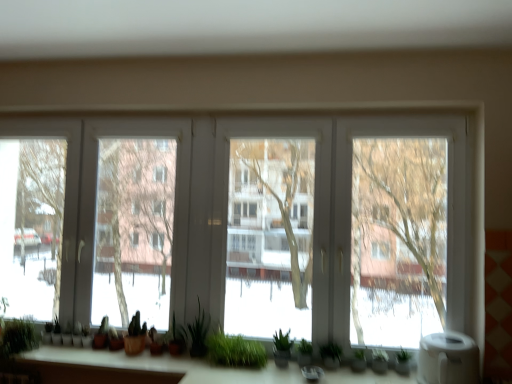
How much space does green matte plant at lower center, which appears as the sixth plant when viewed from the left, occupy horizontally?

5.14 inches.

The image size is (512, 384). Identify the location of green matte plant at lower left, the fifth plant viewed from the right. (102, 334).

Where is `green matte plant at center, the fourth plant in the right-to-left sequence`? The width and height of the screenshot is (512, 384). green matte plant at center, the fourth plant in the right-to-left sequence is located at coordinates (175, 339).

You are a GUI agent. You are given a task and a screenshot of the screen. Output one action in this format:
    pyautogui.click(x=<x>, y=<y>)
    Task: Click on the green matte plant at lower center, which is the second plant in right-to-left order
    The width and height of the screenshot is (512, 384).
    Given the screenshot: What is the action you would take?
    pyautogui.click(x=331, y=351)

I want to click on green grass at center, so click(x=234, y=351).

Does transparent glass windows at center have a lesser height compared to green matte plant at center, which appears as the third plant when viewed from the left?

No.

From a real-world perspective, who is located higher, transparent glass windows at center or green matte plant at center, the fourth plant in the right-to-left sequence?

transparent glass windows at center.

Where is `window to the right of green matte plant at center, which appears as the third plant when viewed from the left`? window to the right of green matte plant at center, which appears as the third plant when viewed from the left is located at coordinates (228, 200).

Consider the image. Is transparent glass windows at center at the left side of green matte plant at center, which appears as the third plant when viewed from the left?

In fact, transparent glass windows at center is to the right of green matte plant at center, which appears as the third plant when viewed from the left.

Which is more to the left, green matte plant at center, the fourth plant in the right-to-left sequence, or transparent glass windows at center?

green matte plant at center, the fourth plant in the right-to-left sequence.

How many degrees apart are the facing directions of green matte plant at center, the fourth plant in the right-to-left sequence, and transparent glass windows at center?

The angle between the facing direction of green matte plant at center, the fourth plant in the right-to-left sequence, and the facing direction of transparent glass windows at center is 4.19e-05 degrees.

Between green matte plant at center, the fourth plant in the right-to-left sequence, and transparent glass windows at center, which one has smaller size?

With smaller size is green matte plant at center, the fourth plant in the right-to-left sequence.

Is white matte water heater at lower right to the left of transparent glass windows at center from the viewer's perspective?

No, white matte water heater at lower right is not to the left of transparent glass windows at center.

Based on their sizes in the image, would you say white matte water heater at lower right is bigger or smaller than transparent glass windows at center?

Clearly, white matte water heater at lower right is smaller in size than transparent glass windows at center.

Would you consider green grass at center to be distant from transparent glass windows at center?

They are positioned close to each other.

Can you confirm if green grass at center is shorter than transparent glass windows at center?

Correct, green grass at center is not as tall as transparent glass windows at center.

Is green grass at center spatially inside transparent glass windows at center, or outside of it?

green grass at center cannot be found inside transparent glass windows at center.

Between green grass at center and transparent glass windows at center, which one appears on the left side from the viewer's perspective?

transparent glass windows at center.

Is white matte water heater at lower right behind green matte plant at lower left, acting as the second plant starting from the left?

That is False.

From a real-world perspective, is white matte water heater at lower right physically below green matte plant at lower left, the fifth plant viewed from the right?

No.

Between white matte water heater at lower right and green matte plant at lower left, the fifth plant viewed from the right, which one appears on the right side from the viewer's perspective?

From the viewer's perspective, white matte water heater at lower right appears more on the right side.

Is white matte water heater at lower right located outside green matte plant at lower left, acting as the second plant starting from the left?

Indeed, white matte water heater at lower right is completely outside green matte plant at lower left, acting as the second plant starting from the left.

From the image's perspective, is green matte plant at lower center, the 5th plant positioned from the left, above or below green matte plant at lower center, which appears as the sixth plant when viewed from the left?

From the image's perspective, green matte plant at lower center, the 5th plant positioned from the left, appears above green matte plant at lower center, which appears as the sixth plant when viewed from the left.

From a real-world perspective, is green matte plant at lower center, which is the second plant in right-to-left order, on green matte plant at lower center, which appears as the sixth plant when viewed from the left?

Yes.

Does green matte plant at lower center, the 5th plant positioned from the left, appear on the left side of green matte plant at lower center, which ranks as the 1th plant in right-to-left order?

Indeed, green matte plant at lower center, the 5th plant positioned from the left, is positioned on the left side of green matte plant at lower center, which ranks as the 1th plant in right-to-left order.

From their relative heights in the image, would you say green matte plant at lower center, the 5th plant positioned from the left, is taller or shorter than green matte plant at lower center, which ranks as the 1th plant in right-to-left order?

Considering their sizes, green matte plant at lower center, the 5th plant positioned from the left, has less height than green matte plant at lower center, which ranks as the 1th plant in right-to-left order.

From a real-world perspective, relative to transparent glass windows at center, is green matte plant at lower center, the 5th plant positioned from the left, vertically above or below?

green matte plant at lower center, the 5th plant positioned from the left, is below transparent glass windows at center.

Find the location of a particular element. window above the green matte plant at lower center, which is the second plant in right-to-left order (from the image's perspective) is located at coordinates (228, 200).

Between point (334, 353) and point (338, 213), which one is positioned in front?

Positioned in front is point (334, 353).

Does green matte plant at lower center, the 5th plant positioned from the left, have a lesser width compared to transparent glass windows at center?

Incorrect, the width of green matte plant at lower center, the 5th plant positioned from the left, is not less than that of transparent glass windows at center.

There is a transparent glass windows at center. Find the location of `the 2nd plant below it (from a real-world perspective)`. the 2nd plant below it (from a real-world perspective) is located at coordinates (175, 339).

I want to click on window above the green matte plant at center, the fourth plant in the right-to-left sequence (from the image's perspective), so click(228, 200).

Estimate the real-world distances between objects in this image. Which object is closer to green grass at center, green matte plant at lower center, which appears as the sixth plant when viewed from the left, or green matte plant at lower left, the fifth plant viewed from the right?

green matte plant at lower center, which appears as the sixth plant when viewed from the left, lies closer to green grass at center than the other object.

When comparing their distances from green matte plant at lower center, which appears as the sixth plant when viewed from the left, does white matte water heater at lower right or green matte plant at center, which appears as the third plant when viewed from the left, seem further?

Among the two, green matte plant at center, which appears as the third plant when viewed from the left, is located further to green matte plant at lower center, which appears as the sixth plant when viewed from the left.

Looking at the image, which one is located further to green matte plant at center, the fourth plant in the right-to-left sequence, green matte plant at lower center, which is the second plant in right-to-left order, or green matte plant at lower center, which appears as the sixth plant when viewed from the left?

Based on the image, green matte plant at lower center, which appears as the sixth plant when viewed from the left, appears to be further to green matte plant at center, the fourth plant in the right-to-left sequence.

Looking at the image, which one is located further to green matte plant at lower left, the fifth plant viewed from the right, green matte plant at center, the 3th plant when ordered from right to left, or transparent glass windows at center?

The object further to green matte plant at lower left, the fifth plant viewed from the right, is transparent glass windows at center.

Which object lies nearer to the anchor point green matte plant at lower left, acting as the second plant starting from the left, green grass at center or green matte plant at lower left, placed as the first plant when sorted from left to right?

Based on the image, green matte plant at lower left, placed as the first plant when sorted from left to right, appears to be nearer to green matte plant at lower left, acting as the second plant starting from the left.

Estimate the real-world distances between objects in this image. Which object is further from green matte plant at center, the 3th plant when ordered from right to left, green matte plant at lower center, which appears as the sixth plant when viewed from the left, or green grass at center?

green matte plant at lower center, which appears as the sixth plant when viewed from the left, lies further to green matte plant at center, the 3th plant when ordered from right to left, than the other object.

Looking at this image, based on their spatial positions, is green matte plant at lower left, placed as the first plant when sorted from left to right, or white matte water heater at lower right closer to green matte plant at lower left, the fifth plant viewed from the right?

green matte plant at lower left, placed as the first plant when sorted from left to right, is positioned closer to the anchor green matte plant at lower left, the fifth plant viewed from the right.

Considering their positions, is white matte water heater at lower right positioned further to transparent glass windows at center than green matte plant at center, the 3th plant when ordered from right to left?

Based on the image, green matte plant at center, the 3th plant when ordered from right to left, appears to be further to transparent glass windows at center.

Locate an element on the screen. This screenshot has width=512, height=384. houseplant between green matte plant at center, the 3th plant when ordered from right to left, and green matte plant at lower center, which ranks as the 1th plant in right-to-left order, from left to right is located at coordinates (234, 351).

The height and width of the screenshot is (384, 512). Identify the location of window between green matte plant at center, which appears as the third plant when viewed from the left, and white matte water heater at lower right, in the horizontal direction. (228, 200).

You are a GUI agent. You are given a task and a screenshot of the screen. Output one action in this format:
    pyautogui.click(x=<x>, y=<y>)
    Task: Click on the plant between green matte plant at center, the fourth plant in the right-to-left sequence, and green matte plant at lower center, the 5th plant positioned from the left
    The width and height of the screenshot is (512, 384).
    Given the screenshot: What is the action you would take?
    pyautogui.click(x=198, y=333)

Image resolution: width=512 pixels, height=384 pixels. I want to click on window between green matte plant at center, which appears as the third plant when viewed from the left, and green matte plant at lower center, which appears as the sixth plant when viewed from the left, so click(228, 200).